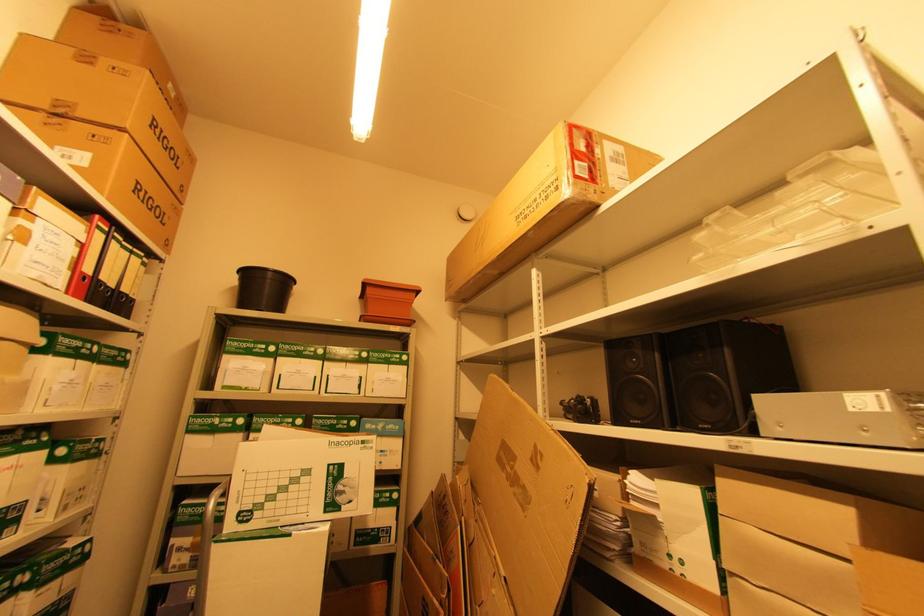
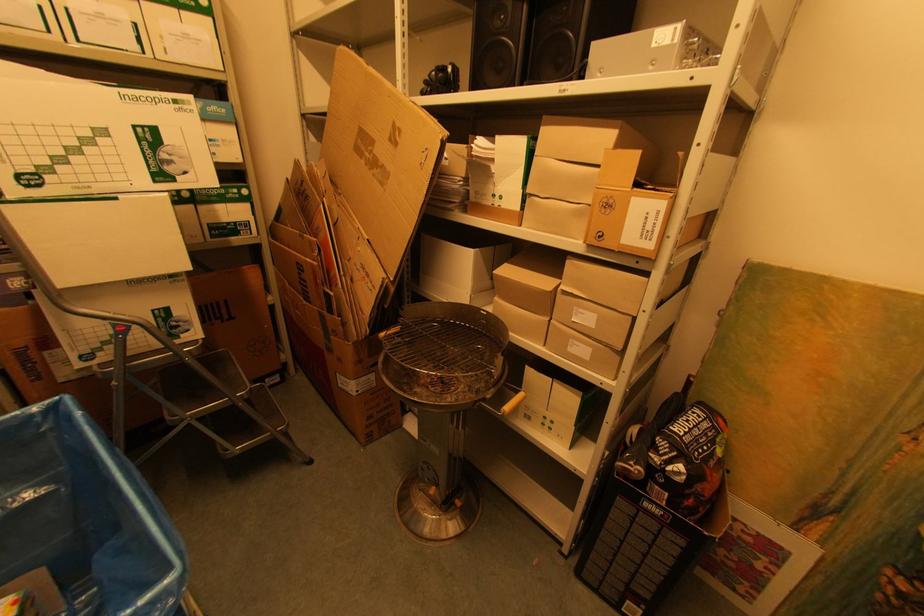
Looking at this image, the images are taken continuously from a first-person perspective. In which direction is your viewpoint rotating?

The camera rotated toward right-down.